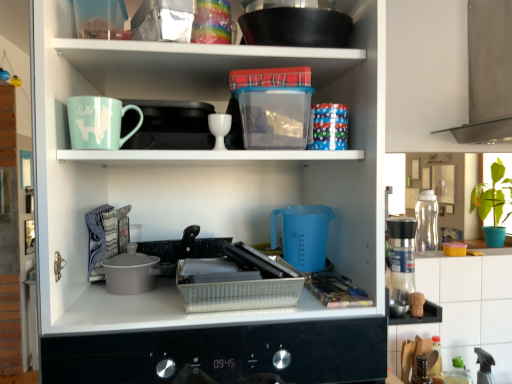
Identify the location of white tile at upper right. (464, 309).

Describe the element at coordinates (199, 169) in the screenshot. I see `blue plastic measuring cup at center` at that location.

Where is `translucent plastic spray bottle at lower right`? This screenshot has height=384, width=512. translucent plastic spray bottle at lower right is located at coordinates (458, 373).

Image resolution: width=512 pixels, height=384 pixels. What are the coordinates of `white tile at upper right` in the screenshot? It's located at (464, 309).

In terms of width, does black non-stick wok at upper center look wider or thinner when compared to transparent plastic water bottle at right, placed as the 2th appliance when sorted from front to back?

Considering their sizes, black non-stick wok at upper center looks broader than transparent plastic water bottle at right, placed as the 2th appliance when sorted from front to back.

From a real-world perspective, is black non-stick wok at upper center physically above transparent plastic water bottle at right, which is counted as the 1th appliance, starting from the right?

Yes, from a real-world perspective, black non-stick wok at upper center is above transparent plastic water bottle at right, which is counted as the 1th appliance, starting from the right.

Image resolution: width=512 pixels, height=384 pixels. I want to click on kitchen appliance located in front of the transparent plastic water bottle at right, which is counted as the 1th appliance, starting from the back, so click(294, 23).

Based on their sizes in the image, would you say black non-stick wok at upper center is bigger or smaller than transparent plastic water bottle at right, placed as the 2th appliance when sorted from front to back?

black non-stick wok at upper center is bigger than transparent plastic water bottle at right, placed as the 2th appliance when sorted from front to back.

From a real-world perspective, does blue plastic measuring cup at center stand above metallic grid tray at center, the second appliance in the back-to-front sequence?

Yes, from a real-world perspective, blue plastic measuring cup at center is on top of metallic grid tray at center, the second appliance in the back-to-front sequence.

Considering the relative sizes of blue plastic measuring cup at center and metallic grid tray at center, positioned as the 2th appliance in right-to-left order, in the image provided, is blue plastic measuring cup at center wider than metallic grid tray at center, positioned as the 2th appliance in right-to-left order,?

Yes, blue plastic measuring cup at center is wider than metallic grid tray at center, positioned as the 2th appliance in right-to-left order.

Considering the relative positions of blue plastic measuring cup at center and metallic grid tray at center, positioned as the 2th appliance in right-to-left order, in the image provided, is blue plastic measuring cup at center to the left of metallic grid tray at center, positioned as the 2th appliance in right-to-left order, from the viewer's perspective?

Yes.

From a real-world perspective, which appliance is the 2nd one above the white tile at upper right? Please provide its 2D coordinates.

[(426, 222)]

Could you measure the distance between white tile at upper right and transparent plastic water bottle at right, which is counted as the 1th appliance, starting from the back?

A distance of 23.30 centimeters exists between white tile at upper right and transparent plastic water bottle at right, which is counted as the 1th appliance, starting from the back.

Can you confirm if white tile at upper right is taller than transparent plastic water bottle at right, which is counted as the 1th appliance, starting from the right?

Indeed, white tile at upper right has a greater height compared to transparent plastic water bottle at right, which is counted as the 1th appliance, starting from the right.

Is white tile at upper right situated inside transparent plastic water bottle at right, which is counted as the 1th appliance, starting from the right, or outside?

white tile at upper right is located beyond the bounds of transparent plastic water bottle at right, which is counted as the 1th appliance, starting from the right.

Based on the photo, which object is thinner, white glossy egg cup at upper center or matte ceramic mug at upper left?

With smaller width is matte ceramic mug at upper left.

How different are the orientations of white glossy egg cup at upper center and matte ceramic mug at upper left in degrees?

The angular difference between white glossy egg cup at upper center and matte ceramic mug at upper left is 1.21 degrees.

Looking at this image, who is smaller, white glossy egg cup at upper center or matte ceramic mug at upper left?

white glossy egg cup at upper center.

Considering the relative positions of white glossy egg cup at upper center and matte ceramic mug at upper left in the image provided, is white glossy egg cup at upper center to the right of matte ceramic mug at upper left from the viewer's perspective?

Yes, white glossy egg cup at upper center is to the right of matte ceramic mug at upper left.

Who is smaller, white glossy egg cup at upper center or white tile at upper right?

Smaller between the two is white glossy egg cup at upper center.

Which object is thinner, white glossy egg cup at upper center or white tile at upper right?

With smaller width is white tile at upper right.

Is point (228, 132) positioned in front of point (493, 308)?

Yes.

How far apart are white glossy egg cup at upper center and white tile at upper right?

white glossy egg cup at upper center and white tile at upper right are 3.52 feet apart from each other.

Considering the relative positions of transparent plastic water bottle at right, placed as the 2th appliance when sorted from left to right, and black non-stick wok at upper center in the image provided, is transparent plastic water bottle at right, placed as the 2th appliance when sorted from left to right, in front of black non-stick wok at upper center?

No, transparent plastic water bottle at right, placed as the 2th appliance when sorted from left to right, is further to the viewer.

Which of these two, transparent plastic water bottle at right, which is counted as the 1th appliance, starting from the back, or black non-stick wok at upper center, stands shorter?

Standing shorter between the two is black non-stick wok at upper center.

From the image's perspective, is transparent plastic water bottle at right, placed as the 2th appliance when sorted from front to back, above or below black non-stick wok at upper center?

transparent plastic water bottle at right, placed as the 2th appliance when sorted from front to back, is below black non-stick wok at upper center.

Is transparent plastic water bottle at right, which is counted as the 1th appliance, starting from the right, looking in the opposite direction of black non-stick wok at upper center?

No, black non-stick wok at upper center is not at the back of transparent plastic water bottle at right, which is counted as the 1th appliance, starting from the right.

Is transparent plastic water bottle at right, placed as the 2th appliance when sorted from left to right, oriented away from white tile at upper right?

No, transparent plastic water bottle at right, placed as the 2th appliance when sorted from left to right,'s orientation is not away from white tile at upper right.

Is transparent plastic water bottle at right, placed as the 2th appliance when sorted from left to right, thinner than white tile at upper right?

No, transparent plastic water bottle at right, placed as the 2th appliance when sorted from left to right, is not thinner than white tile at upper right.

Considering the relative sizes of transparent plastic water bottle at right, placed as the 2th appliance when sorted from front to back, and white tile at upper right in the image provided, is transparent plastic water bottle at right, placed as the 2th appliance when sorted from front to back, shorter than white tile at upper right?

Yes.

Is transparent plastic water bottle at right, placed as the 2th appliance when sorted from left to right, inside or outside of white tile at upper right?

transparent plastic water bottle at right, placed as the 2th appliance when sorted from left to right, is spatially situated outside white tile at upper right.

This screenshot has width=512, height=384. I want to click on the 1st appliance located beneath the black non-stick wok at upper center (from a real-world perspective), so click(x=426, y=222).

Find the location of a particular element. The height and width of the screenshot is (384, 512). shelf above the metallic grid tray at center, arranged as the first appliance when viewed from the front (from the image's perspective) is located at coordinates click(199, 169).

Which object lies nearer to the anchor point metallic grid tray at center, arranged as the first appliance when viewed from the front, matte ceramic mug at upper left or white glossy egg cup at upper center?

Based on the image, white glossy egg cup at upper center appears to be nearer to metallic grid tray at center, arranged as the first appliance when viewed from the front.

From the image, which object appears to be farther from metallic grid tray at center, positioned as the 2th appliance in right-to-left order, matte ceramic mug at upper left or blue plastic measuring cup at center?

Based on the image, matte ceramic mug at upper left appears to be further to metallic grid tray at center, positioned as the 2th appliance in right-to-left order.

Looking at the image, which one is located closer to white glossy egg cup at upper center, transparent plastic water bottle at right, placed as the 2th appliance when sorted from left to right, or blue plastic measuring cup at center?

blue plastic measuring cup at center is positioned closer to the anchor white glossy egg cup at upper center.

From the image, which object appears to be farther from blue plastic measuring cup at center, metallic grid tray at center, the second appliance in the back-to-front sequence, or white glossy egg cup at upper center?

Among the two, white glossy egg cup at upper center is located further to blue plastic measuring cup at center.

In the scene shown: Which object lies nearer to the anchor point matte ceramic mug at upper left, blue plastic measuring cup at center or white glossy egg cup at upper center?

white glossy egg cup at upper center is positioned closer to the anchor matte ceramic mug at upper left.

From the image, which object appears to be nearer to white tile at upper right, translucent plastic spray bottle at lower right or black non-stick wok at upper center?

translucent plastic spray bottle at lower right is positioned closer to the anchor white tile at upper right.

When comparing their distances from blue plastic measuring cup at center, does white glossy egg cup at upper center or translucent plastic spray bottle at lower right seem further?

The object further to blue plastic measuring cup at center is translucent plastic spray bottle at lower right.

When comparing their distances from transparent plastic water bottle at right, placed as the 2th appliance when sorted from front to back, does metallic grid tray at center, arranged as the first appliance when viewed from the front, or white tile at upper right seem closer?

The object closer to transparent plastic water bottle at right, placed as the 2th appliance when sorted from front to back, is white tile at upper right.

Image resolution: width=512 pixels, height=384 pixels. What are the coordinates of `shelf between matte ceramic mug at upper left and translucent plastic spray bottle at lower right in the horizontal direction` in the screenshot? It's located at (199, 169).

At what (x,y) coordinates should I click in order to perform the action: click on tableware between black non-stick wok at upper center and metallic grid tray at center, the second appliance in the back-to-front sequence, in the up-down direction. Please return your answer as a coordinate pair (x, y). The height and width of the screenshot is (384, 512). Looking at the image, I should click on (219, 128).

Where is `appliance between black non-stick wok at upper center and transparent plastic water bottle at right, placed as the 2th appliance when sorted from front to back, in the front-back direction`? This screenshot has height=384, width=512. appliance between black non-stick wok at upper center and transparent plastic water bottle at right, placed as the 2th appliance when sorted from front to back, in the front-back direction is located at coordinates pos(237,281).

The width and height of the screenshot is (512, 384). Find the location of `tableware located between blue plastic measuring cup at center and translucent plastic spray bottle at lower right in the left-right direction`. tableware located between blue plastic measuring cup at center and translucent plastic spray bottle at lower right in the left-right direction is located at coordinates (219, 128).